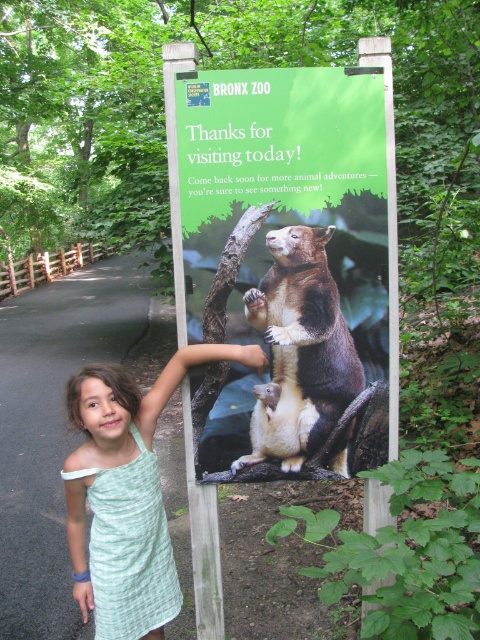
Does brown furry bear at center have a greater height compared to green woven dress at center?

In fact, brown furry bear at center may be shorter than green woven dress at center.

Between point (253, 419) and point (123, 406), which one is positioned behind?

The point (253, 419) is behind.

This screenshot has height=640, width=480. I want to click on brown furry bear at center, so click(x=300, y=349).

Can you confirm if green paper sign at center is shorter than brown furry bear at center?

No.

In the scene shown: Which of these two, green paper sign at center or brown furry bear at center, stands shorter?

brown furry bear at center is shorter.

I want to click on green paper sign at center, so click(283, 272).

I want to click on green paper sign at center, so click(x=283, y=272).

Is point (302, 72) positioned in front of point (132, 445)?

That is False.

Looking at this image, can you confirm if green paper sign at center is thinner than green woven dress at center?

No, green paper sign at center is not thinner than green woven dress at center.

Image resolution: width=480 pixels, height=640 pixels. What do you see at coordinates (283, 272) in the screenshot? I see `green paper sign at center` at bounding box center [283, 272].

The height and width of the screenshot is (640, 480). What are the coordinates of `green paper sign at center` in the screenshot? It's located at (283, 272).